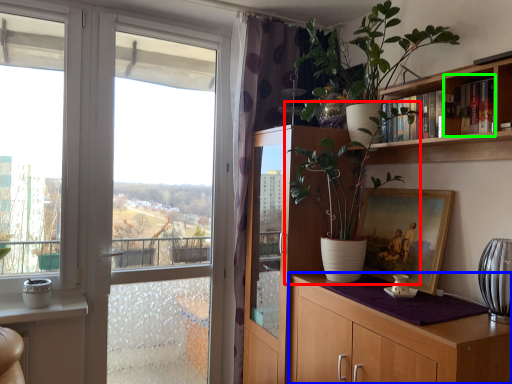
Question: Considering the real-world distances, which object is closest to houseplant (highlighted by a red box)? cabinetry (highlighted by a blue box) or cabinet (highlighted by a green box).

Choices:
 (A) cabinetry
 (B) cabinet

Answer: (A)